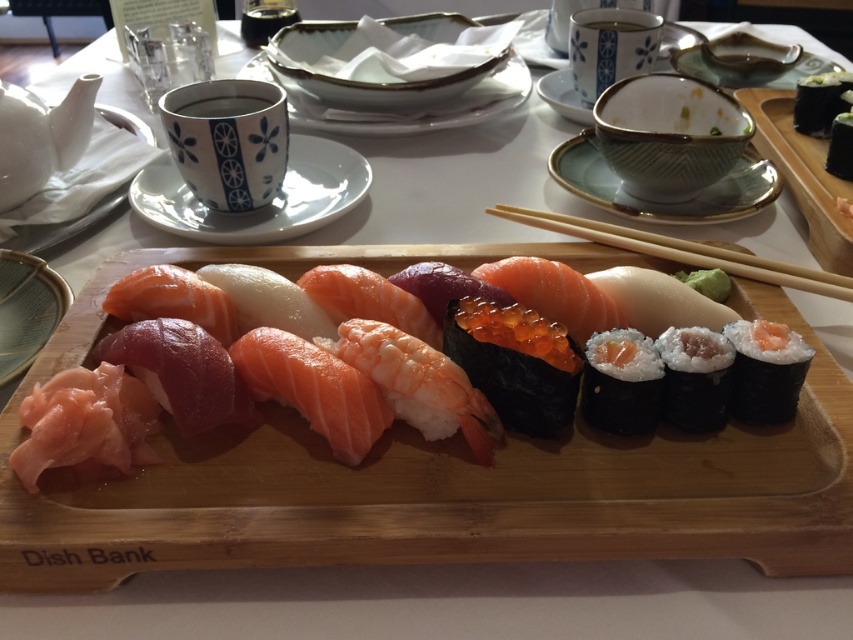
You are a food critic standing 1.7 meters tall and want to taste the pink rice at right. Can you reach it without moving your body?

The pink rice at right is 35.76 centimeters away from the viewer. Since the average arm length is about 60 centimeters, you can easily reach it without moving your body.

You are a chef preparing a dish and need to choose between the white ceramic plate at upper center and the white porcelain plate at upper center. Based on their sizes, which plate would you recommend for a larger portion of food?

The white porcelain plate at upper center occupies more space than the white ceramic plate at upper center, so it would be better to choose the white porcelain plate at upper center for a larger portion of food.

You are a food critic inspecting a sushi platter. You notice the white rice at center and the matte glass plate at lower left. Which object is closer to you from your viewing position?

The white rice at center is positioned under the matte glass plate at lower left, meaning the matte glass plate at lower left is closer to you.